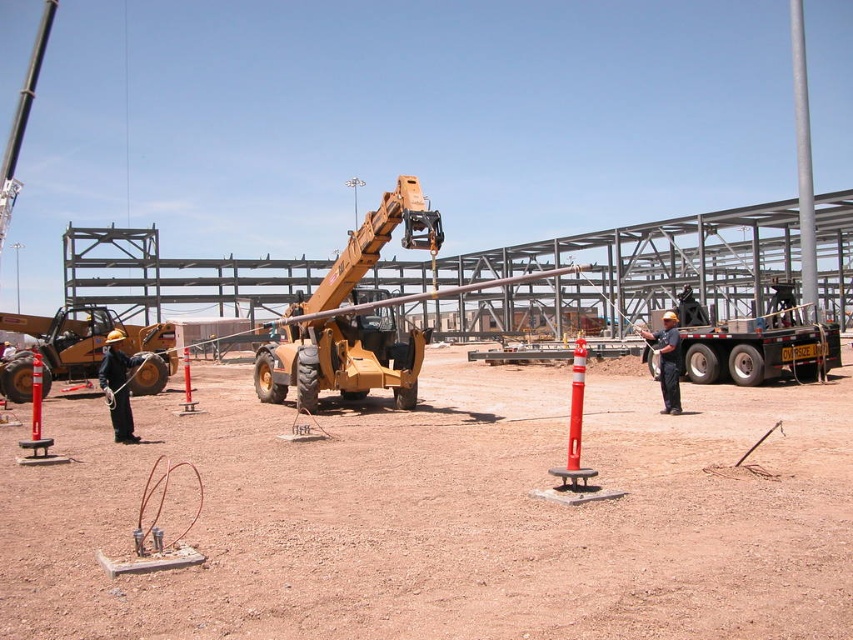
From the picture: Does matte yellow crane at left appear under dark blue uniform at center?

Correct, matte yellow crane at left is located below dark blue uniform at center.

I want to click on matte yellow crane at left, so click(94, 346).

Does matte yellow crane at left have a smaller size compared to metallic trailer truck at center?

No.

What do you see at coordinates (94, 346) in the screenshot? This screenshot has width=853, height=640. I see `matte yellow crane at left` at bounding box center [94, 346].

Identify the location of matte yellow crane at left. The height and width of the screenshot is (640, 853). (94, 346).

Is matte yellow telescopic handler at center closer to camera compared to silver metallic pole at upper right?

Yes, matte yellow telescopic handler at center is closer to the viewer.

Can you confirm if matte yellow telescopic handler at center is positioned above silver metallic pole at upper right?

No, matte yellow telescopic handler at center is not above silver metallic pole at upper right.

Who is more forward, (x=310, y=408) or (x=813, y=237)?

Positioned in front is point (x=310, y=408).

You are a GUI agent. You are given a task and a screenshot of the screen. Output one action in this format:
    pyautogui.click(x=<x>, y=<y>)
    Task: Click on the matte yellow telescopic handler at center
    The image size is (853, 640).
    Given the screenshot: What is the action you would take?
    pyautogui.click(x=351, y=317)